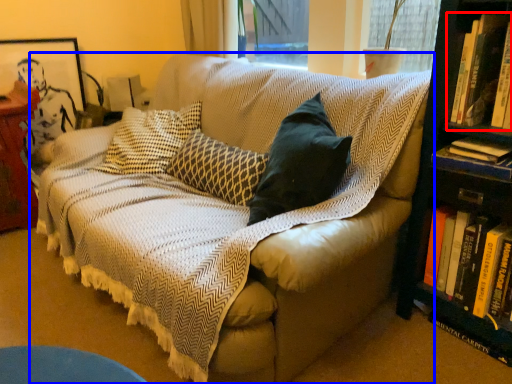
Question: Which of the following is the farthest to the observer, book (highlighted by a red box) or studio couch (highlighted by a blue box)?

Choices:
 (A) book
 (B) studio couch

Answer: (A)